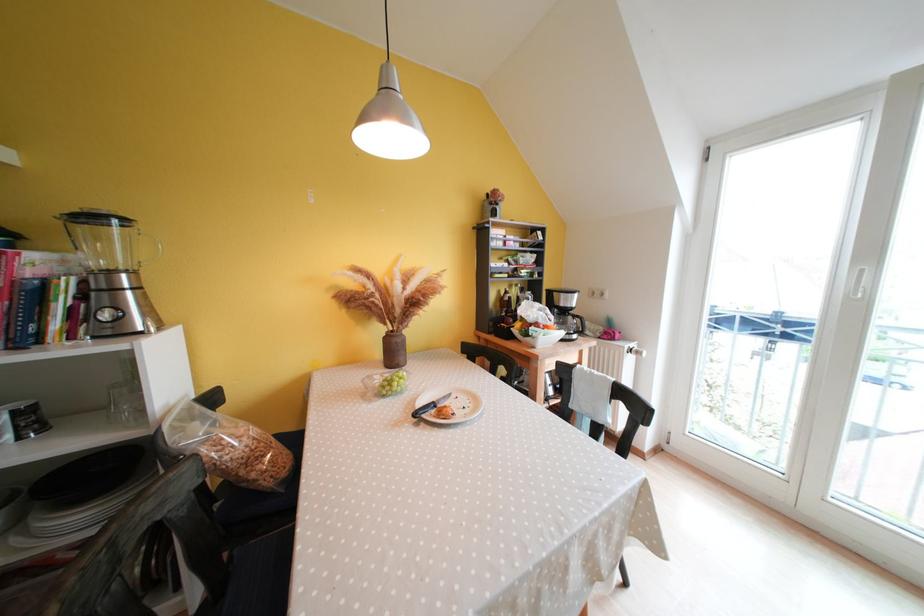
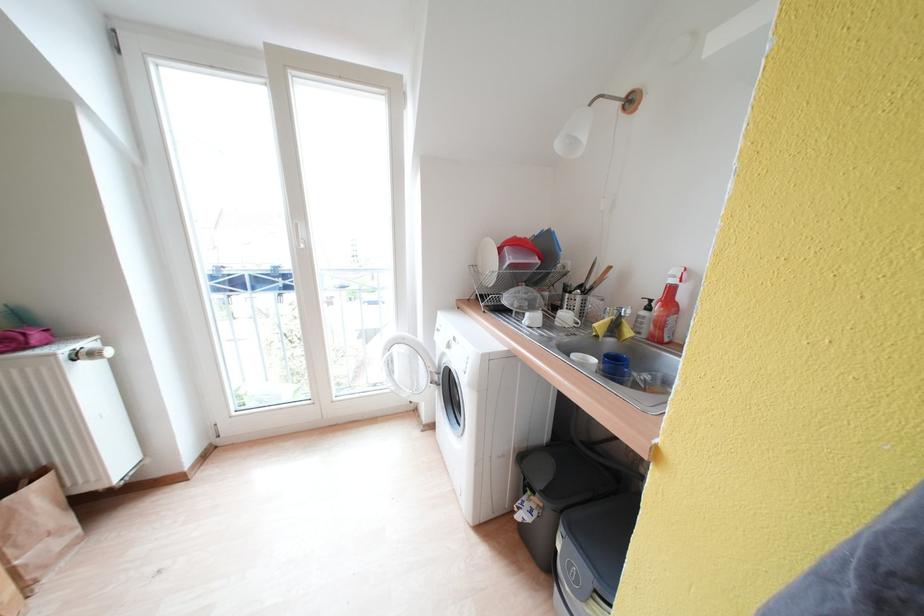
The point at (618, 342) is marked in the first image. Where is the corresponding point in the second image?

(30, 351)